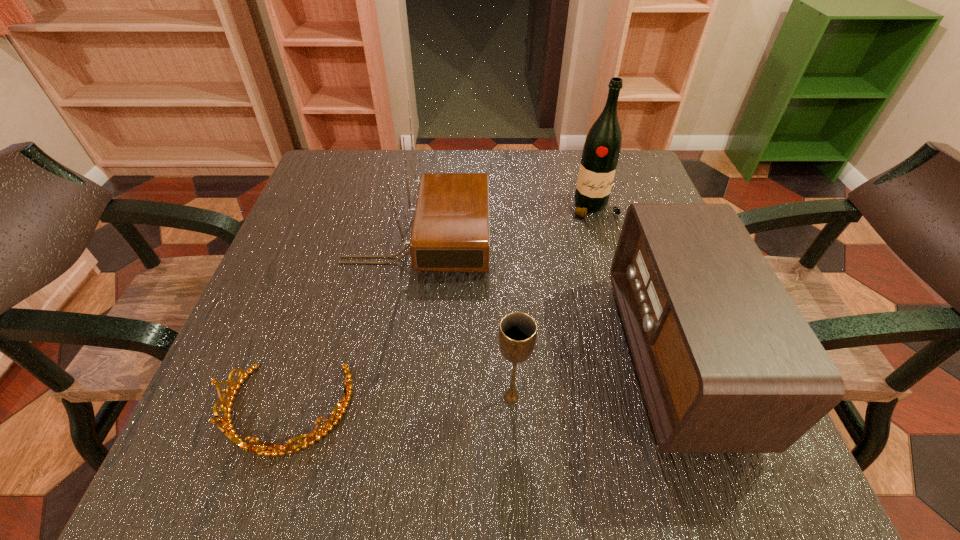
This screenshot has height=540, width=960. I want to click on object located in the far left corner section of the desktop, so click(x=450, y=232).

What are the coordinates of `object that is positioned at the near left corner` in the screenshot? It's located at (273, 449).

Where is `object present at the far right corner`? The width and height of the screenshot is (960, 540). object present at the far right corner is located at coordinates (601, 151).

At what (x,y) coordinates should I click in order to perform the action: click on object located at the near right corner. Please return your answer as a coordinate pair (x, y). The image size is (960, 540). Looking at the image, I should click on (727, 363).

In the image, there is a desktop. Identify the location of vacant space at the far edge. (547, 151).

In the image, there is a desktop. Where is `free region at the near edge`? Image resolution: width=960 pixels, height=540 pixels. free region at the near edge is located at coordinates (466, 440).

You are a GUI agent. You are given a task and a screenshot of the screen. Output one action in this format:
    pyautogui.click(x=<x>, y=<y>)
    Task: Click on the blank space at the left edge of the desktop
    Image resolution: width=960 pixels, height=540 pixels.
    Given the screenshot: What is the action you would take?
    pyautogui.click(x=308, y=378)

Where is `vacant space at the far left corner`? vacant space at the far left corner is located at coordinates (370, 178).

Image resolution: width=960 pixels, height=540 pixels. Identify the location of vacant region at the far right corner of the desktop. (653, 185).

This screenshot has width=960, height=540. I want to click on vacant space in between the shorter radio receiver and the fourth shortest object, so click(x=546, y=297).